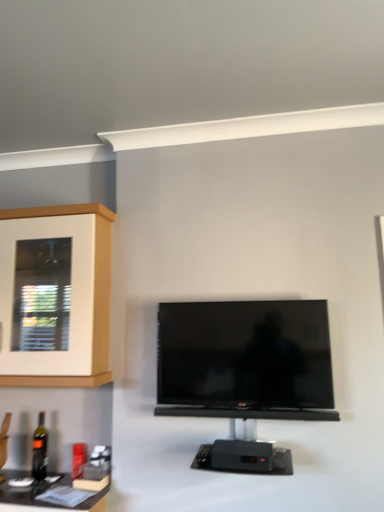
Question: Is wooden cabinet at left a part of black glossy tv at center?

Choices:
 (A) yes
 (B) no

Answer: (B)

Question: Is black glossy tv at center oriented away from wooden cabinet at left?

Choices:
 (A) no
 (B) yes

Answer: (A)

Question: Is black glossy tv at center positioned in front of wooden cabinet at left?

Choices:
 (A) yes
 (B) no

Answer: (A)

Question: Is black glossy tv at center not close to wooden cabinet at left?

Choices:
 (A) no
 (B) yes

Answer: (A)

Question: Does black glossy tv at center have a lesser width compared to wooden cabinet at left?

Choices:
 (A) no
 (B) yes

Answer: (B)

Question: Based on their positions, is black glossy tv at center located to the left or right of black glass bottle at lower left?

Choices:
 (A) left
 (B) right

Answer: (B)

Question: In terms of width, does black glossy tv at center look wider or thinner when compared to black glass bottle at lower left?

Choices:
 (A) wide
 (B) thin

Answer: (A)

Question: Is black glossy tv at center inside or outside of black glass bottle at lower left?

Choices:
 (A) outside
 (B) inside

Answer: (A)

Question: Does point [x=185, y=362] appear closer or farther from the camera than point [x=39, y=412]?

Choices:
 (A) farther
 (B) closer

Answer: (B)

Question: Is black glass bottle at lower left inside the boundaries of black glossy tv at center, or outside?

Choices:
 (A) outside
 (B) inside

Answer: (A)

Question: From the image's perspective, relative to black glossy tv at center, is black glass bottle at lower left above or below?

Choices:
 (A) below
 (B) above

Answer: (A)

Question: Visually, is black glass bottle at lower left positioned to the left or to the right of black glossy tv at center?

Choices:
 (A) right
 (B) left

Answer: (B)

Question: Relative to black glossy tv at center, is black glass bottle at lower left in front or behind?

Choices:
 (A) behind
 (B) front

Answer: (A)

Question: Relative to black glossy tv at center, is wooden cabinet at left in front or behind?

Choices:
 (A) behind
 (B) front

Answer: (A)

Question: In terms of size, does wooden cabinet at left appear bigger or smaller than black glossy tv at center?

Choices:
 (A) big
 (B) small

Answer: (A)